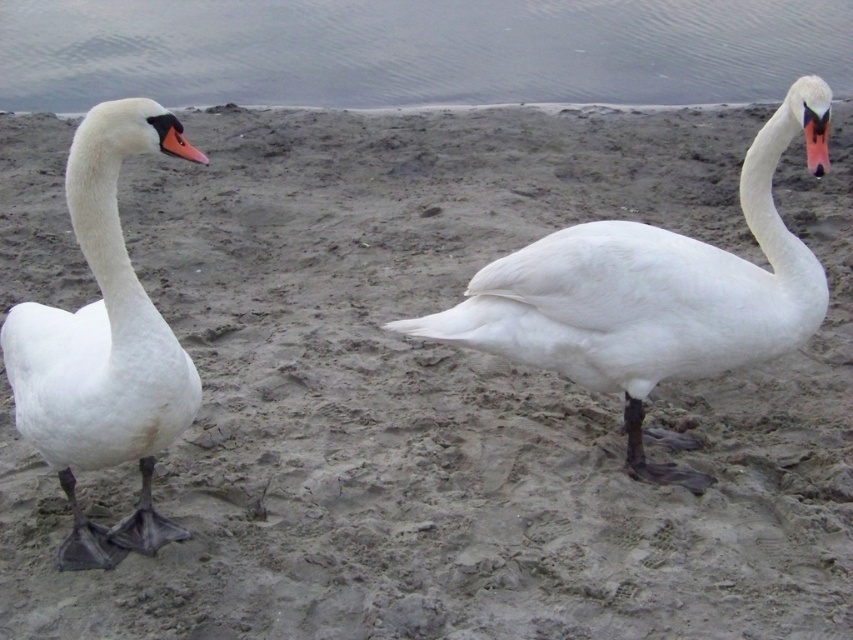
Can you confirm if smooth water at upper center is positioned below white matte swan at left?

No.

Is point (660, 60) closer to viewer compared to point (45, 353)?

No, (660, 60) is further to viewer.

The height and width of the screenshot is (640, 853). Identify the location of smooth water at upper center. (416, 51).

Between matte orange beak at upper right and matte orange beak at left, which one is positioned lower?

matte orange beak at left is lower down.

Is matte orange beak at upper right to the right of matte orange beak at left from the viewer's perspective?

Indeed, matte orange beak at upper right is positioned on the right side of matte orange beak at left.

Who is more distant from viewer, (808, 122) or (198, 150)?

Positioned behind is point (198, 150).

I want to click on matte orange beak at upper right, so click(x=815, y=140).

Who is more distant from viewer, [202,1] or [192,150]?

Point [202,1]

Can you confirm if smooth water at upper center is bigger than matte orange beak at left?

Indeed, smooth water at upper center has a larger size compared to matte orange beak at left.

Who is more distant from viewer, (117,29) or (178,145)?

Point (117,29)

You are a GUI agent. You are given a task and a screenshot of the screen. Output one action in this format:
    pyautogui.click(x=<x>, y=<y>)
    Task: Click on the smooth water at upper center
    The image size is (853, 640).
    Given the screenshot: What is the action you would take?
    pyautogui.click(x=416, y=51)